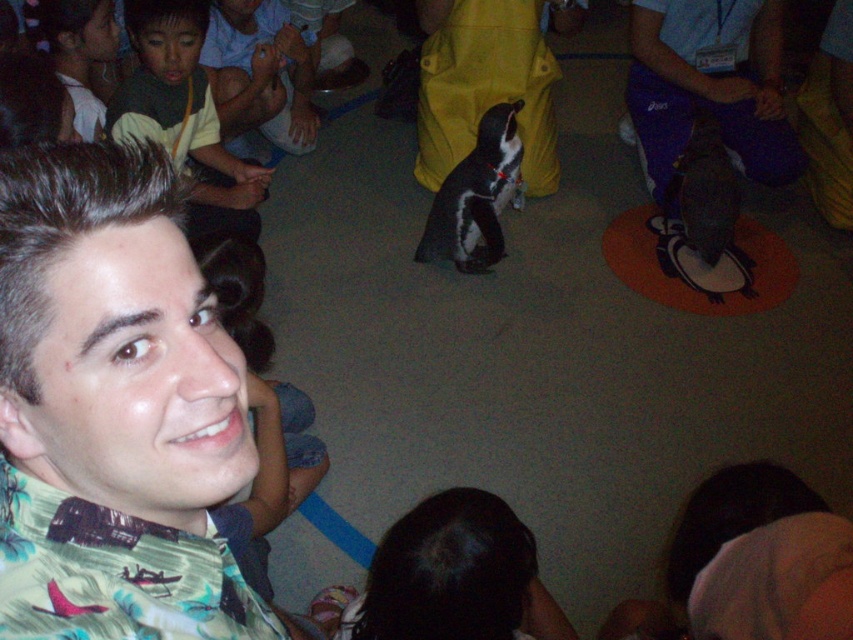
You are a photographer trying to capture a group photo of the people in the scene. You need to ensure that both the matte green shirt at left and the light brown hair at upper left are visible in the frame. Based on their positions, which one should you place on the right side of the other in the photo?

The matte green shirt at left is positioned on the right side of light brown hair at upper left, so in the photo, the matte green shirt at left should be placed on the right side of the light brown hair at upper left to maintain their original positions.

You are a photographer at the event and want to capture a photo that includes both the floral fabric shirt at center and the matte green shirt at left. Which shirt should you focus on first to ensure both are in frame?

The floral fabric shirt at center is smaller in size compared to the matte green shirt at left, so you should focus on the larger matte green shirt at left first to ensure both fit within the frame.

You are a photographer trying to capture a clear shot of the light brown hair at upper left and the floral fabric shirt at center. Which object should you focus on first to ensure both are in focus?

You should focus on the floral fabric shirt at center first because it is closer to the viewer than the light brown hair at upper left, so adjusting focus from near to far will help both be in focus.